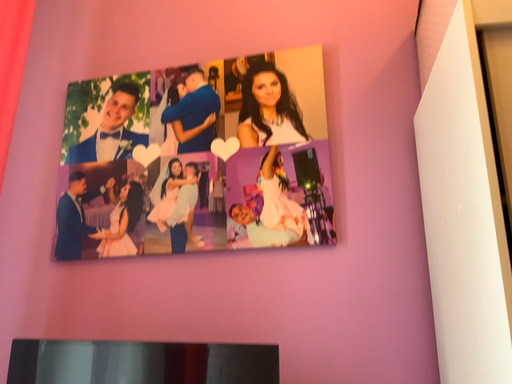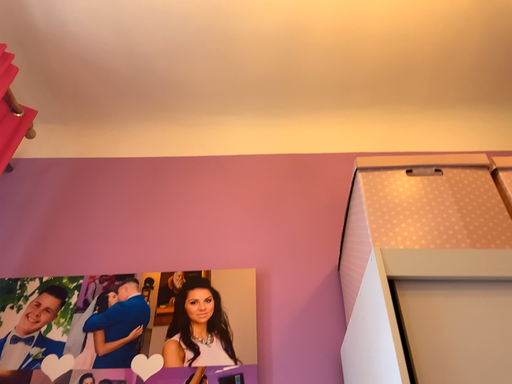
Question: How did the camera likely rotate when shooting the video?

Choices:
 (A) rotated right
 (B) rotated left

Answer: (A)